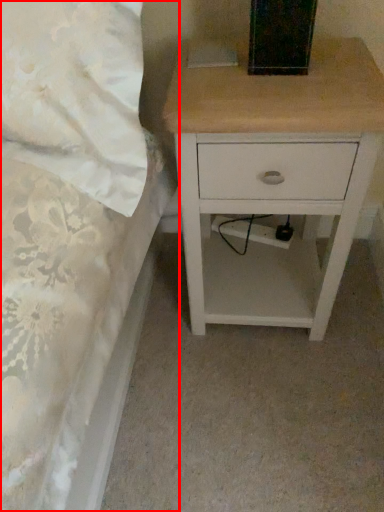
Question: From the image's perspective, considering the relative positions of bed (annotated by the red box) and nightstand in the image provided, where is bed (annotated by the red box) located with respect to the staircase?

Choices:
 (A) below
 (B) above

Answer: (B)